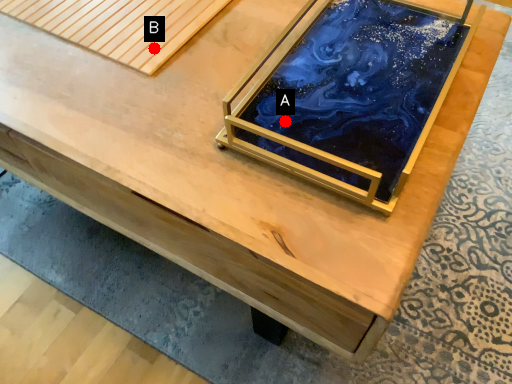
Question: Two points are circled on the image, labeled by A and B beside each circle. Which point is closer to the camera taking this photo?

Choices:
 (A) A is closer
 (B) B is closer

Answer: (A)